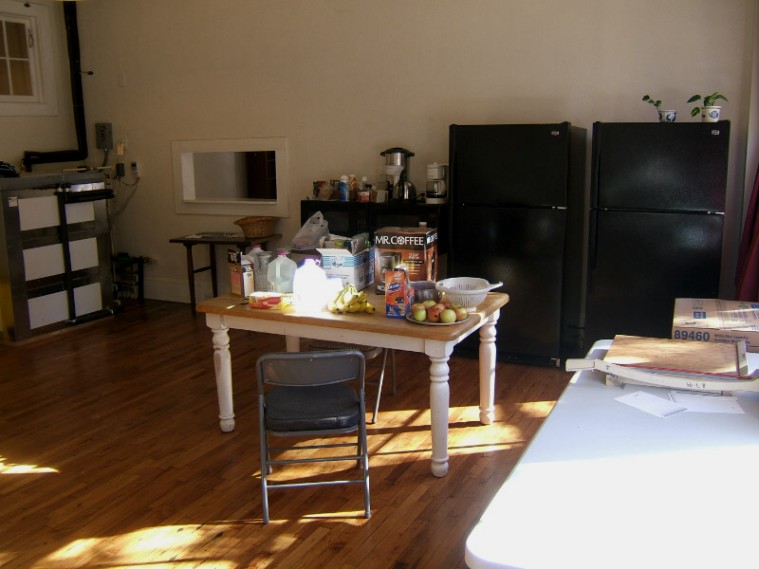
Identify the location of table leg. The width and height of the screenshot is (759, 569). (436, 387).